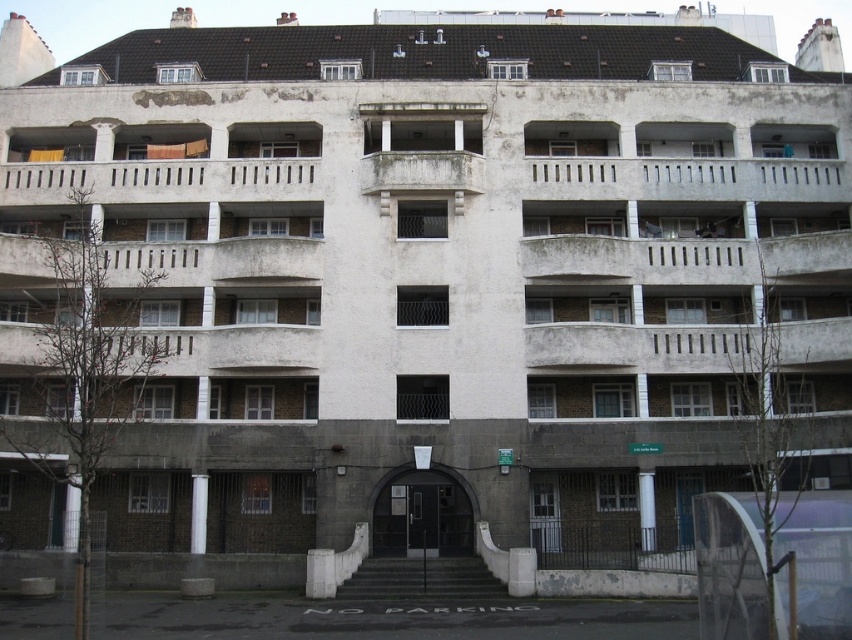
Question: Which point is closer to the camera taking this photo?

Choices:
 (A) (471, 566)
 (B) (114, 172)

Answer: (A)

Question: Can you confirm if white concrete balcony at center is wider than white concrete balcony at upper center?

Choices:
 (A) yes
 (B) no

Answer: (A)

Question: Which of the following is the farthest from the observer?

Choices:
 (A) white concrete balcony at upper center
 (B) white concrete balcony at center

Answer: (A)

Question: Does white concrete balcony at upper center appear on the right side of dark gray concrete stairs at center?

Choices:
 (A) yes
 (B) no

Answer: (A)

Question: Does white concrete balcony at upper center come behind dark gray concrete stairs at center?

Choices:
 (A) no
 (B) yes

Answer: (B)

Question: Which object is closer to the camera taking this photo?

Choices:
 (A) white concrete balcony at upper center
 (B) dark gray concrete stairs at center
 (C) white concrete balcony at center

Answer: (B)